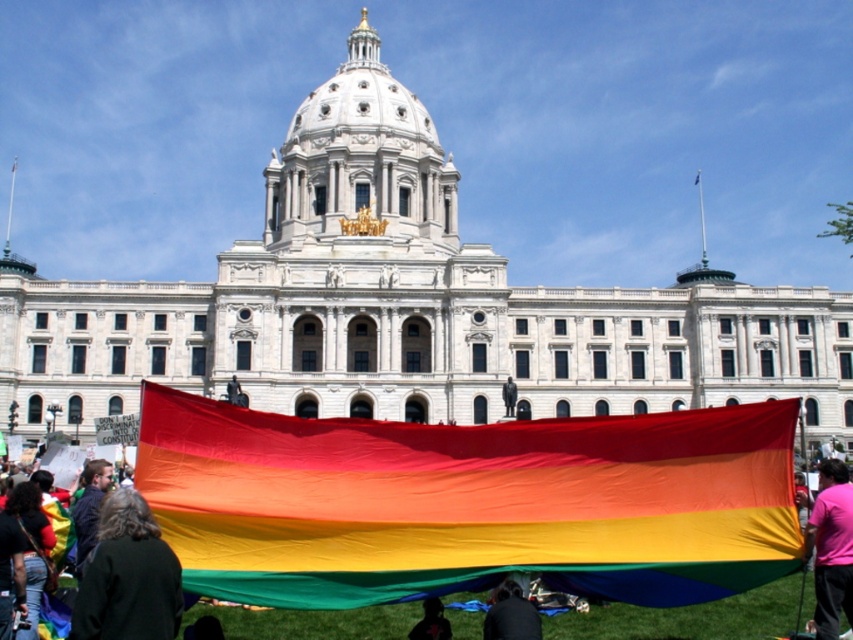
You are standing at the point marked by the coordinate point at (469, 502) in the image. What object is directly in front of you?

The point at (469, 502) indicates the rainbow fabric flag at center is directly in front of you.

You are standing at the location of the camera and want to retrieve the dark brown leather jacket at lower left. Is the jacket within a 30 meter radius from your current position?

The dark brown leather jacket at lower left and camera are 31.42 meters apart from each other, so the jacket is just outside the 30 meter radius from your current position.

You are a photographer trying to capture the rainbow fabric flag at center and the dark fabric head at lower center in a single shot. Can you see both objects clearly in your camera frame?

The dark fabric head at lower center is behind the rainbow fabric flag at center, so it might be partially obscured. You can still see both objects but the dark fabric head at lower center may not be fully visible.